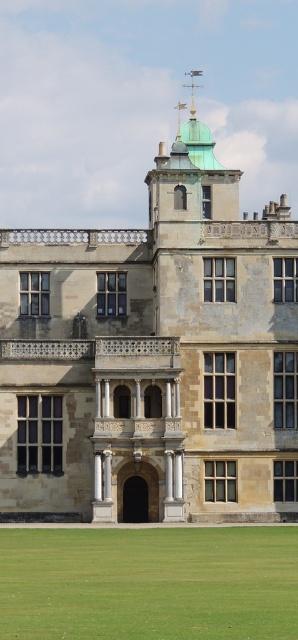
You are standing in a garden and see the stone textured palace at center and the green grass at lower center. Which object is positioned to the right of the other?

The stone textured palace at center is to the right of green grass at lower center.